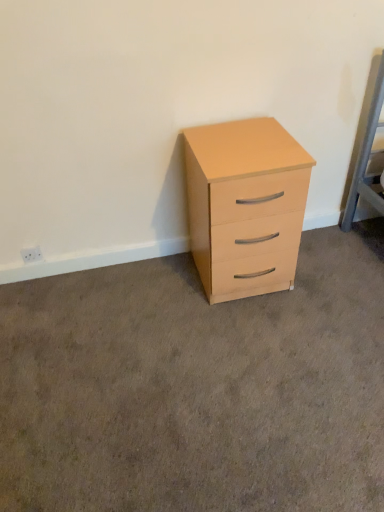
At what (x,y) coordinates should I click in order to perform the action: click on blank space above light wood drawer at center (from a real-world perspective). Please return your answer as a coordinate pair (x, y). Looking at the image, I should click on (213, 351).